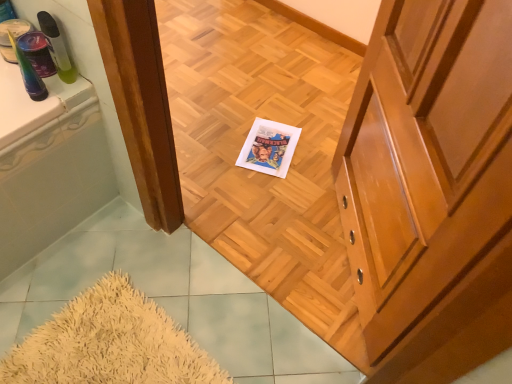
Question: Is translucent plastic cup at upper left, which ranks as the 2th toiletry in right-to-left order, in front of or behind shiny wood cabinet at right in the image?

Choices:
 (A) front
 (B) behind

Answer: (B)

Question: Considering the relative positions of translucent plastic cup at upper left, which ranks as the 2th toiletry in right-to-left order, and shiny wood cabinet at right in the image provided, is translucent plastic cup at upper left, which ranks as the 2th toiletry in right-to-left order, to the left or to the right of shiny wood cabinet at right?

Choices:
 (A) right
 (B) left

Answer: (B)

Question: Which is nearer to the shiny wood cabinet at right?

Choices:
 (A) translucent plastic cup at upper left, which ranks as the 2th toiletry in right-to-left order
 (B) translucent plastic spray bottle at upper left, which ranks as the second toiletry in left-to-right order

Answer: (B)

Question: Estimate the real-world distances between objects in this image. Which object is farther from the translucent plastic spray bottle at upper left, which ranks as the second toiletry in left-to-right order?

Choices:
 (A) shiny wood cabinet at right
 (B) translucent plastic cup at upper left, the first toiletry viewed from the left

Answer: (A)